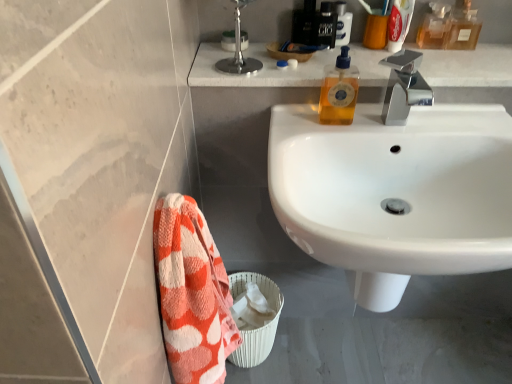
In order to click on white glossy sink at center in this screenshot , I will do `click(395, 191)`.

What is the approximate height of black plastic soap dispenser at upper right, which is counted as the 1th toiletry, starting from the back?

11.71 centimeters.

This screenshot has height=384, width=512. In order to click on black plastic soap dispenser at upper right, arranged as the third toiletry when viewed from the front in this screenshot , I will do `click(343, 24)`.

Describe the element at coordinates (325, 25) in the screenshot. I see `shiny black bottle at upper center, the 2th toiletry in the front-to-back sequence` at that location.

In order to face translucent amber liquid at upper right, which is counted as the 3th mouthwash, starting from the left, should I rotate leftwards or rightwards?

You should look right and rotate roughly 22.674 degrees.

At what (x,y) coordinates should I click in order to perform the action: click on white glossy sink at center. Please return your answer as a coordinate pair (x, y). Looking at the image, I should click on (395, 191).

Considering the positions of objects black plastic soap dispenser at upper right, arranged as the third toiletry when viewed from the front, and white glossy sink at center in the image provided, who is more to the right, black plastic soap dispenser at upper right, arranged as the third toiletry when viewed from the front, or white glossy sink at center?

white glossy sink at center.

Is black plastic soap dispenser at upper right, which ranks as the first toiletry in top-to-bottom order, completely or partially outside of white glossy sink at center?

black plastic soap dispenser at upper right, which ranks as the first toiletry in top-to-bottom order, lies outside white glossy sink at center's area.

Is black plastic soap dispenser at upper right, which ranks as the first toiletry in top-to-bottom order, far from white glossy sink at center?

They are positioned close to each other.

Looking at this image, from their relative heights in the image, would you say black plastic soap dispenser at upper right, arranged as the third toiletry when viewed from the front, is taller or shorter than white glossy sink at center?

Clearly, black plastic soap dispenser at upper right, arranged as the third toiletry when viewed from the front, is shorter compared to white glossy sink at center.

Is white plastic toothpaste tube at upper right, the third mouthwash in the right-to-left sequence, surrounded by transparent glass bottle at upper right, the first mouthwash positioned from the right?

No, white plastic toothpaste tube at upper right, the third mouthwash in the right-to-left sequence, is not surrounded by transparent glass bottle at upper right, the first mouthwash positioned from the right.

Does transparent glass bottle at upper right, the first mouthwash positioned from the right, lie behind white plastic toothpaste tube at upper right, marked as the 2th mouthwash in a left-to-right arrangement?

Yes, transparent glass bottle at upper right, the first mouthwash positioned from the right, is further from the camera.

Who is taller, transparent glass bottle at upper right, acting as the fourth mouthwash starting from the left, or white plastic toothpaste tube at upper right, marked as the 2th mouthwash in a left-to-right arrangement?

With more height is white plastic toothpaste tube at upper right, marked as the 2th mouthwash in a left-to-right arrangement.

Considering the positions of objects transparent glass bottle at upper right, acting as the fourth mouthwash starting from the left, and white plastic toothpaste tube at upper right, marked as the 2th mouthwash in a left-to-right arrangement, in the image provided, who is more to the right, transparent glass bottle at upper right, acting as the fourth mouthwash starting from the left, or white plastic toothpaste tube at upper right, marked as the 2th mouthwash in a left-to-right arrangement,?

Positioned to the right is transparent glass bottle at upper right, acting as the fourth mouthwash starting from the left.

Is white glossy sink at center oriented towards polished chrome faucet at upper right?

No, white glossy sink at center is not oriented towards polished chrome faucet at upper right.

Where is `sink that is under the polished chrome faucet at upper right (from a real-world perspective)`? This screenshot has height=384, width=512. sink that is under the polished chrome faucet at upper right (from a real-world perspective) is located at coordinates (395, 191).

Can we say white glossy sink at center lies outside polished chrome faucet at upper right?

Yes, white glossy sink at center is not within polished chrome faucet at upper right.

I want to click on tap above the white woven basket at lower center (from a real-world perspective), so click(x=404, y=87).

How distant is polished chrome faucet at upper right from white woven basket at lower center?

polished chrome faucet at upper right is 74.89 centimeters away from white woven basket at lower center.

Considering the sizes of objects polished chrome faucet at upper right and white woven basket at lower center in the image provided, who is bigger, polished chrome faucet at upper right or white woven basket at lower center?

white woven basket at lower center.

Is polished chrome faucet at upper right oriented towards white woven basket at lower center?

No, polished chrome faucet at upper right is not turned towards white woven basket at lower center.

Is point (429, 59) farther from camera compared to point (390, 88)?

Yes, point (429, 59) is farther from viewer.

You are a GUI agent. You are given a task and a screenshot of the screen. Output one action in this format:
    pyautogui.click(x=<x>, y=<y>)
    Task: Click on the counter top on the left of polished chrome faucet at upper right
    This screenshot has width=512, height=384.
    Given the screenshot: What is the action you would take?
    pyautogui.click(x=260, y=71)

Is white marble countertop at upper center completely or partially outside of polished chrome faucet at upper right?

white marble countertop at upper center lies outside polished chrome faucet at upper right's area.

From the image's perspective, which object appears higher, polished chrome faucet at upper right or yellow liquid soap at upper right, the 3th toiletry in the back-to-front sequence?

yellow liquid soap at upper right, the 3th toiletry in the back-to-front sequence, is shown above in the image.

Is polished chrome faucet at upper right to the left or to the right of yellow liquid soap at upper right, acting as the 1th toiletry starting from the bottom, in the image?

polished chrome faucet at upper right is to the right of yellow liquid soap at upper right, acting as the 1th toiletry starting from the bottom.

Is polished chrome faucet at upper right facing towards yellow liquid soap at upper right, marked as the 1th toiletry in a front-to-back arrangement?

No, polished chrome faucet at upper right is not oriented towards yellow liquid soap at upper right, marked as the 1th toiletry in a front-to-back arrangement.

Is yellow liquid soap at upper right, marked as the 1th toiletry in a front-to-back arrangement, surrounded by polished chrome faucet at upper right?

No.

From the image's perspective, is transparent glass bottle at upper right, the first mouthwash positioned from the right, located beneath polished chrome faucet at upper right?

Incorrect, from the image's perspective, transparent glass bottle at upper right, the first mouthwash positioned from the right, is higher than polished chrome faucet at upper right.

Is transparent glass bottle at upper right, the first mouthwash positioned from the right, oriented towards polished chrome faucet at upper right?

No, transparent glass bottle at upper right, the first mouthwash positioned from the right, is not oriented towards polished chrome faucet at upper right.

Based on the photo, does transparent glass bottle at upper right, the first mouthwash positioned from the right, have a greater width compared to polished chrome faucet at upper right?

No.

Based on the photo, which point is more distant from viewer, (458,40) or (251,59)?

Positioned behind is point (458,40).

Find the location of a particular element. sink lying on the right of black plastic soap dispenser at upper right, which is counted as the 1th toiletry, starting from the back is located at coordinates (395, 191).

Find the location of a particular element. This screenshot has width=512, height=384. the 2nd mouthwash located beneath the white plastic toothpaste tube at upper right, the third mouthwash in the right-to-left sequence (from a real-world perspective) is located at coordinates (462, 27).

From the image, which object appears to be nearer to white marble countertop at upper center, orange cotton towel at lower left or transparent glass bottle at upper right, the first mouthwash positioned from the right?

transparent glass bottle at upper right, the first mouthwash positioned from the right, is positioned closer to the anchor white marble countertop at upper center.

Estimate the real-world distances between objects in this image. Which object is further from polished chrome faucet at upper right, white glossy sink at center or translucent amber liquid at upper right, which is counted as the 3th mouthwash, starting from the left?

translucent amber liquid at upper right, which is counted as the 3th mouthwash, starting from the left, is further to polished chrome faucet at upper right.

Based on their spatial positions, is yellow liquid soap at upper right, acting as the 1th toiletry starting from the bottom, or orange cotton towel at lower left closer to translucent amber liquid at upper right, which is the 2th mouthwash from right to left?

The object closer to translucent amber liquid at upper right, which is the 2th mouthwash from right to left, is yellow liquid soap at upper right, acting as the 1th toiletry starting from the bottom.

Based on the photo, from the image, which object appears to be farther from translucent amber liquid at upper right, which is counted as the 3th mouthwash, starting from the left, white plastic toothpaste tube at upper right, the third mouthwash in the right-to-left sequence, or white woven basket at lower center?

The object further to translucent amber liquid at upper right, which is counted as the 3th mouthwash, starting from the left, is white woven basket at lower center.

From the image, which object appears to be farther from black plastic soap dispenser at upper right, which is counted as the 1th toiletry, starting from the back, shiny black bottle at upper center, the 2th toiletry in the back-to-front sequence, or orange cotton towel at lower left?

Based on the image, orange cotton towel at lower left appears to be further to black plastic soap dispenser at upper right, which is counted as the 1th toiletry, starting from the back.

Considering their positions, is transparent glass bottle at upper right, the first mouthwash positioned from the right, positioned closer to black plastic soap dispenser at upper right, arranged as the third toiletry when viewed from the front, than translucent amber liquid at upper right, which is counted as the 3th mouthwash, starting from the left?

translucent amber liquid at upper right, which is counted as the 3th mouthwash, starting from the left, is closer to black plastic soap dispenser at upper right, arranged as the third toiletry when viewed from the front.

Which object lies nearer to the anchor point orange cotton towel at lower left, shiny black bottle at upper center, the 2th toiletry in the back-to-front sequence, or translucent amber liquid at upper right, which is the 2th mouthwash from right to left?

Among the two, shiny black bottle at upper center, the 2th toiletry in the back-to-front sequence, is located nearer to orange cotton towel at lower left.

From the image, which object appears to be farther from orange cotton towel at lower left, black plastic soap dispenser at upper right, the third toiletry positioned from the bottom, or transparent glass bottle at upper right, the first mouthwash positioned from the right?

Based on the image, transparent glass bottle at upper right, the first mouthwash positioned from the right, appears to be further to orange cotton towel at lower left.

At what (x,y) coordinates should I click in order to perform the action: click on tap that lies between transparent glass bottle at upper right, the first mouthwash positioned from the right, and white woven basket at lower center from top to bottom. Please return your answer as a coordinate pair (x, y). This screenshot has height=384, width=512. Looking at the image, I should click on (404, 87).

The image size is (512, 384). In order to click on counter top between white plastic toothpaste tube at upper right, marked as the 2th mouthwash in a left-to-right arrangement, and yellow liquid soap at upper right, marked as the 1th toiletry in a front-to-back arrangement, vertically in this screenshot , I will do (x=260, y=71).

Find the location of a particular element. counter top between polished chrome faucet at upper right and translucent amber liquid at upper right, which is the 2th mouthwash from right to left, along the z-axis is located at coordinates (260, 71).

Where is `toiletry between white marble countertop at upper center and orange cotton towel at lower left from top to bottom`? The width and height of the screenshot is (512, 384). toiletry between white marble countertop at upper center and orange cotton towel at lower left from top to bottom is located at coordinates (339, 91).